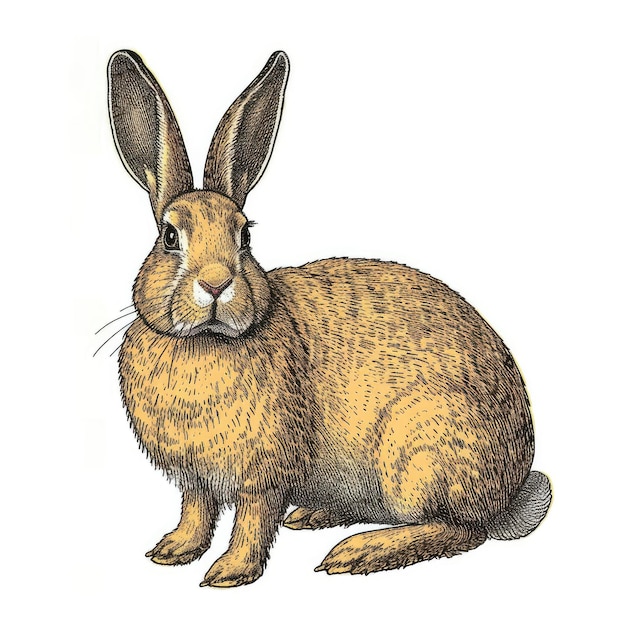
Identify the location of right front leg. Image resolution: width=626 pixels, height=626 pixels. (193, 535).